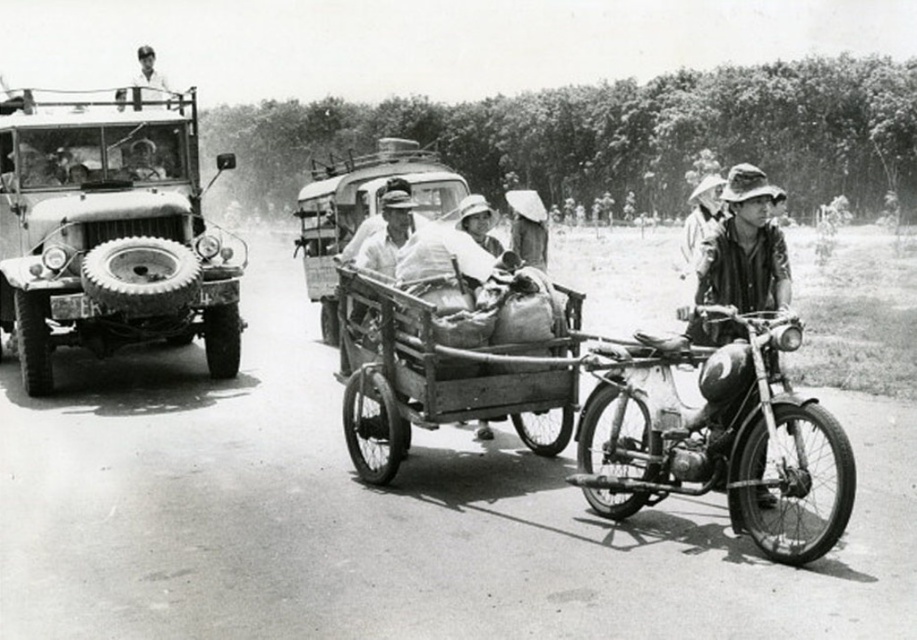
Is rusty metal jeep at left to the left of wooden cart at center from the viewer's perspective?

Yes, rusty metal jeep at left is to the left of wooden cart at center.

Who is shorter, rusty metal jeep at left or wooden cart at center?

wooden cart at center is shorter.

Between point (183, 205) and point (382, 364), which one is positioned in front?

Point (382, 364) is in front.

Identify the location of rusty metal jeep at left. This screenshot has width=917, height=640. (108, 234).

Between rusty metal jeep at left and light-colored shirt at upper left, which one has more height?

light-colored shirt at upper left

What do you see at coordinates (108, 234) in the screenshot?
I see `rusty metal jeep at left` at bounding box center [108, 234].

Identify the location of rusty metal jeep at left. (108, 234).

Does rusty metal jeep at left have a lesser height compared to matte black motorcycle at right?

No, rusty metal jeep at left is not shorter than matte black motorcycle at right.

Does point (168, 212) come closer to viewer compared to point (746, 266)?

No.

This screenshot has width=917, height=640. I want to click on rusty metal jeep at left, so click(108, 234).